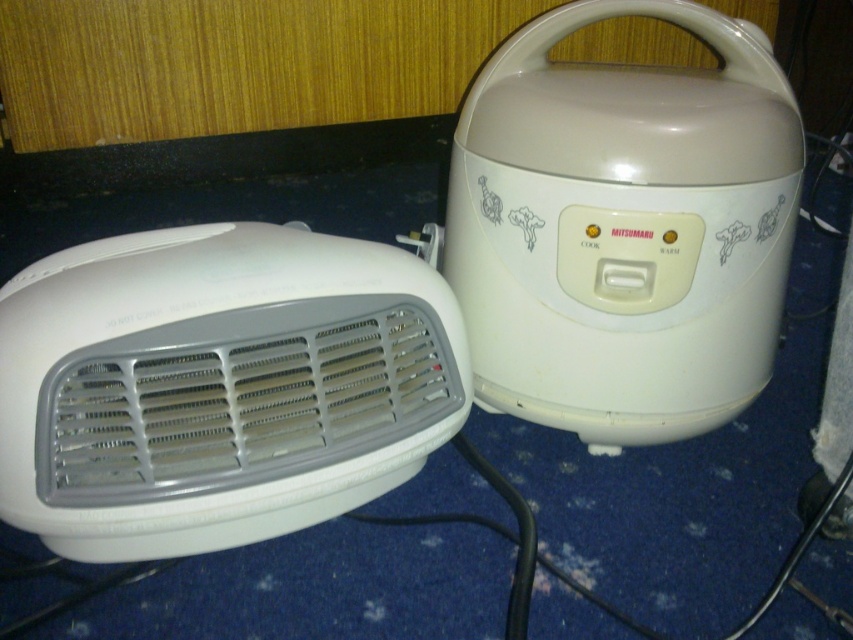
Question: Where is white plastic heater at left located in relation to white glossy rice cooker at right in the image?

Choices:
 (A) above
 (B) below

Answer: (B)

Question: Can you confirm if white plastic heater at left is positioned below white glossy rice cooker at right?

Choices:
 (A) no
 (B) yes

Answer: (B)

Question: Does white plastic heater at left appear under white glossy rice cooker at right?

Choices:
 (A) no
 (B) yes

Answer: (B)

Question: Which point is closer to the camera?

Choices:
 (A) (383, 406)
 (B) (611, 243)

Answer: (A)

Question: Which point is closer to the camera taking this photo?

Choices:
 (A) (596, 264)
 (B) (262, 348)

Answer: (B)

Question: Which point appears closest to the camera in this image?

Choices:
 (A) (381, 328)
 (B) (631, 429)

Answer: (A)